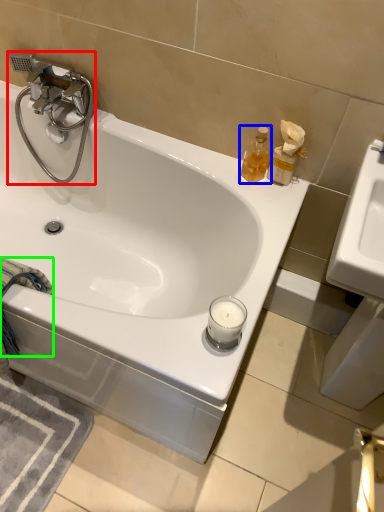
Question: Which object is the farthest from tap (highlighted by a red box)? Choose among these: soap dispenser (highlighted by a blue box) or bath towel (highlighted by a green box).

Choices:
 (A) soap dispenser
 (B) bath towel

Answer: (A)